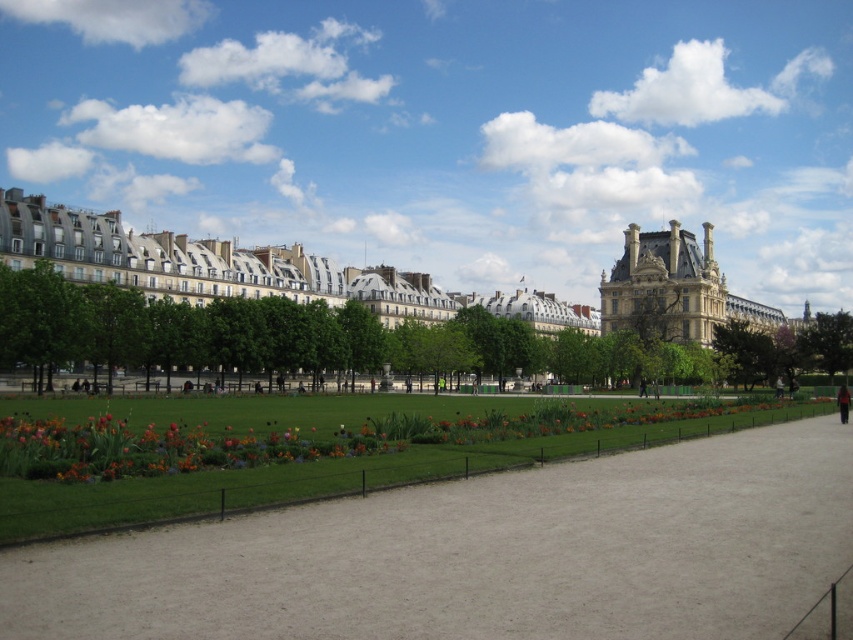
You are a park visitor standing at the edge of the pathway. You see the green grass at center and the black fabric person at center. Which object is closer to you?

The black fabric person at center is closer to you because they are positioned over the green grass at center, indicating they are in a higher layer.

You are a gardener standing at the edge of the green grass at center. You want to water the green leafy tree at center. Which direction should you move to reach the tree?

The green grass at center is below the green leafy tree at center, so you should move upward to reach the tree.